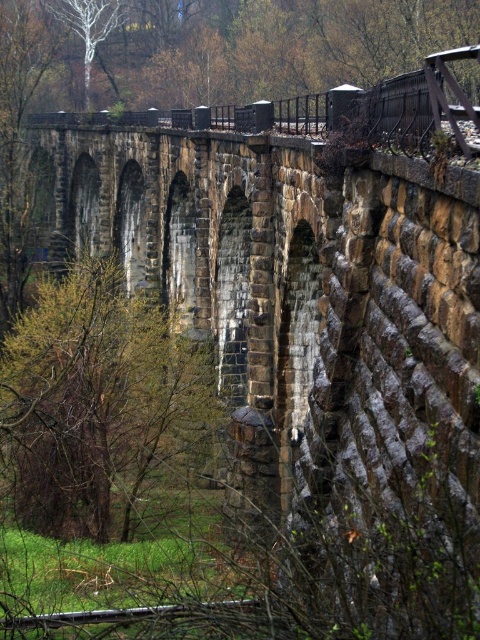
Can you confirm if green leafy tree at center is positioned to the left of smooth metal train track at lower center?

Indeed, green leafy tree at center is positioned on the left side of smooth metal train track at lower center.

Does green leafy tree at center appear over smooth metal train track at lower center?

Indeed, green leafy tree at center is positioned over smooth metal train track at lower center.

You are a GUI agent. You are given a task and a screenshot of the screen. Output one action in this format:
    pyautogui.click(x=<x>, y=<y>)
    Task: Click on the green leafy tree at center
    
    Given the screenshot: What is the action you would take?
    pyautogui.click(x=100, y=404)

Image resolution: width=480 pixels, height=640 pixels. Find the location of `green leafy tree at center`. green leafy tree at center is located at coordinates (100, 404).

Does green leafy tree at center have a smaller size compared to white smooth tree at upper left?

Actually, green leafy tree at center might be larger than white smooth tree at upper left.

Is point (140, 330) positioned in front of point (118, 4)?

Yes, it is in front of point (118, 4).

This screenshot has width=480, height=640. Identify the location of green leafy tree at center. (100, 404).

Does smooth metal train track at lower center appear over white smooth tree at upper left?

No.

Is smooth metal train track at lower center to the right of white smooth tree at upper left from the viewer's perspective?

Indeed, smooth metal train track at lower center is positioned on the right side of white smooth tree at upper left.

Between point (245, 608) and point (118, 3), which one is positioned behind?

Positioned behind is point (118, 3).

What are the coordinates of `smooth metal train track at lower center` in the screenshot? It's located at (122, 614).